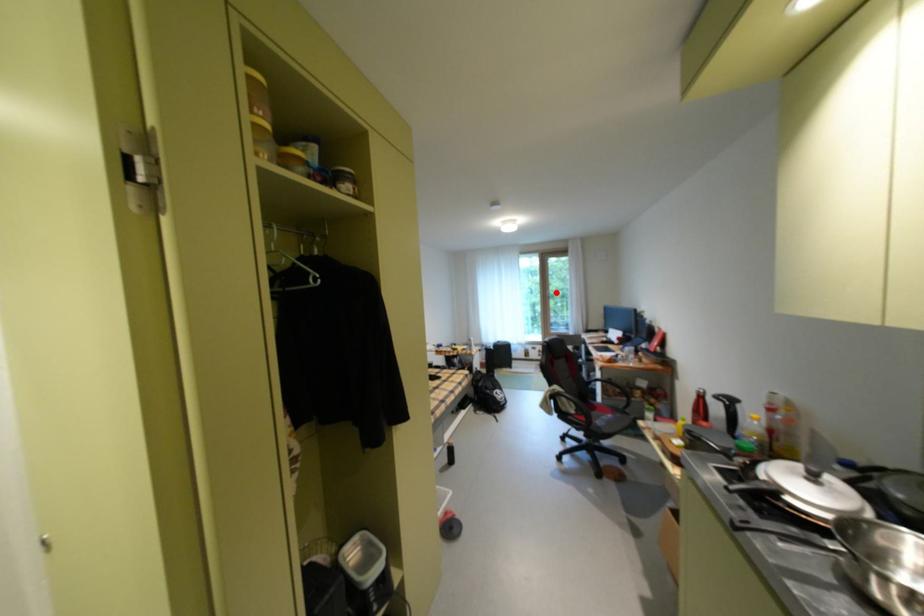
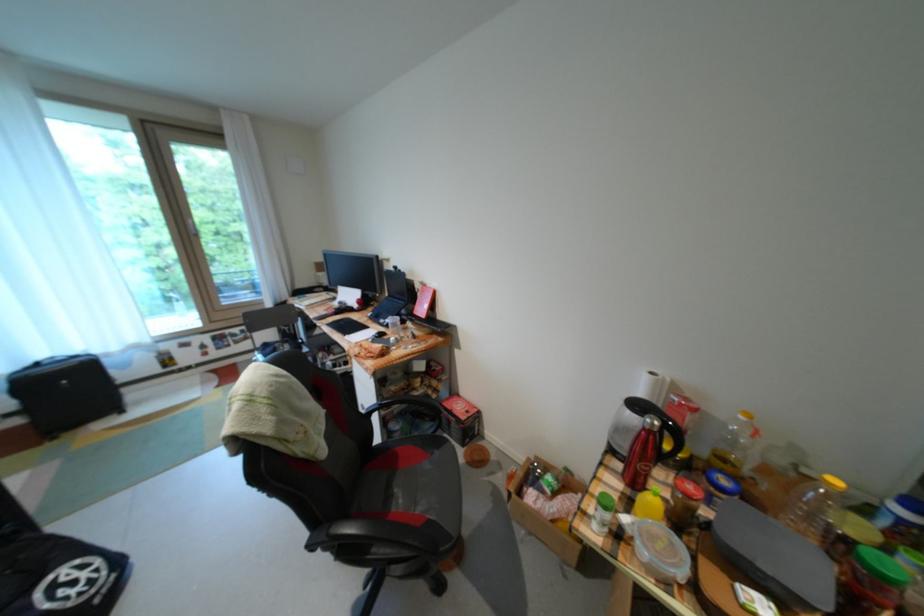
Find the pixel in the second image that matches the highlighted location in the first image.

(195, 223)